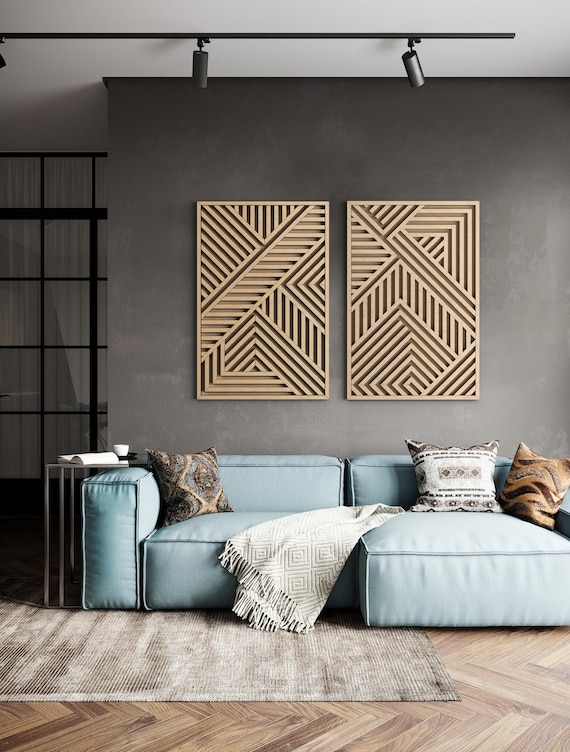
Identify the location of brown pillow with swirls on the right. (527, 484).